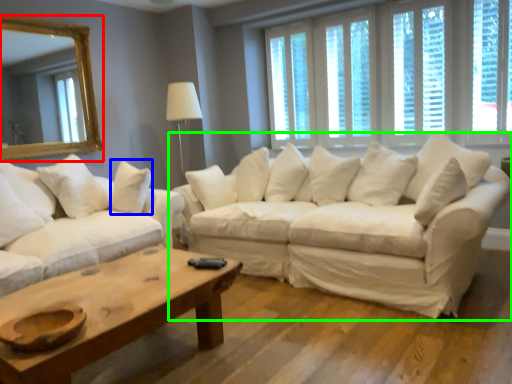
Question: Which is farther away from mirror (highlighted by a red box)? pillow (highlighted by a blue box) or studio couch (highlighted by a green box)?

Choices:
 (A) pillow
 (B) studio couch

Answer: (B)